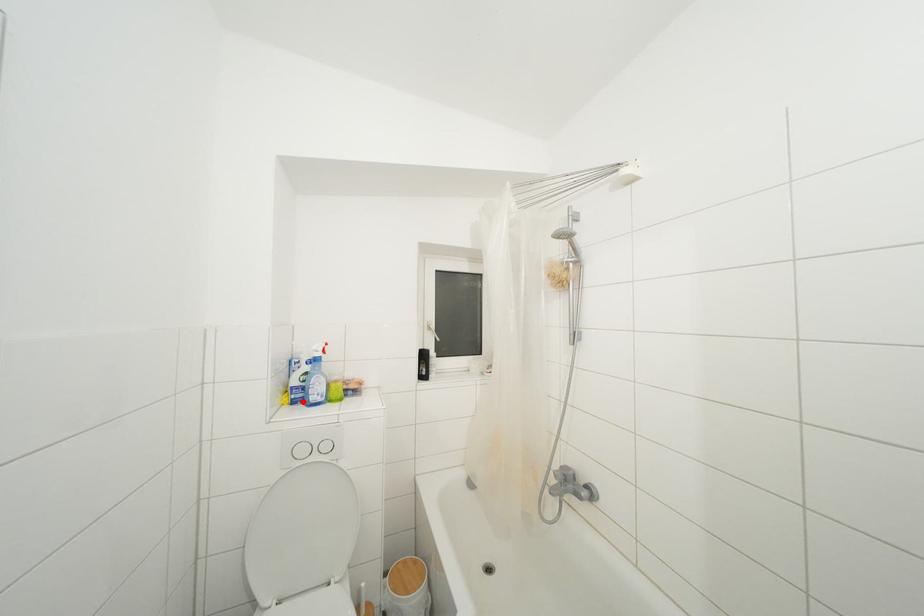
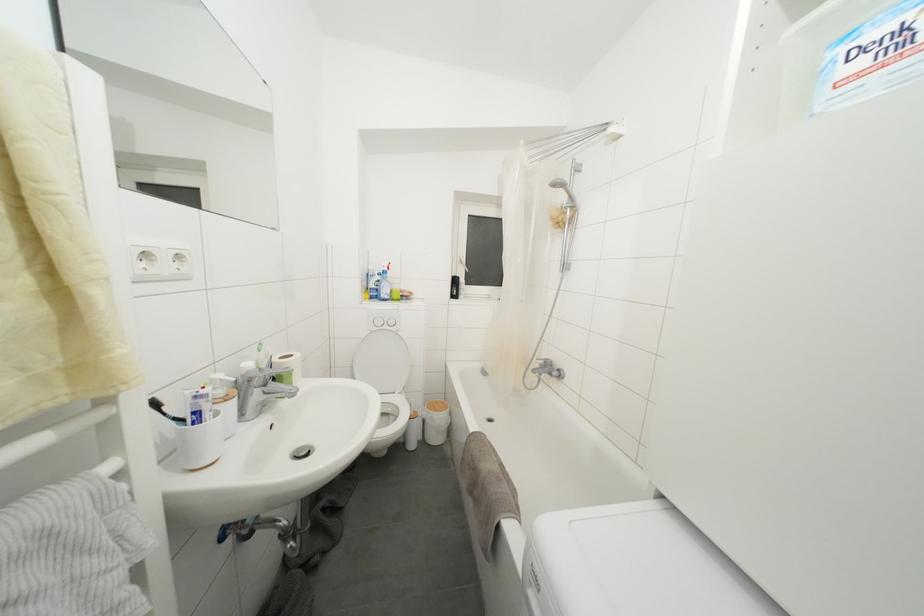
The point at the highlighted location is marked in the first image. Where is the corresponding point in the second image?

(379, 300)